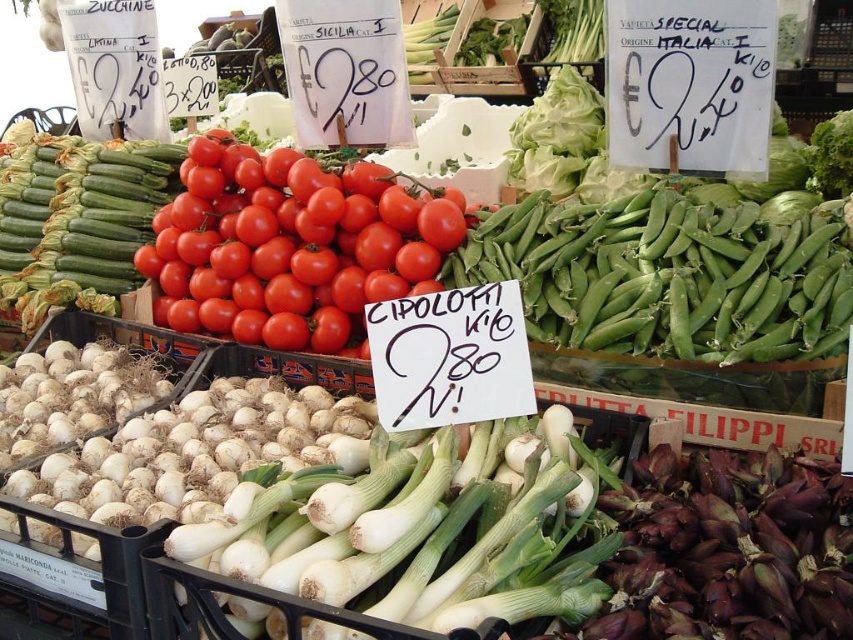
Is green smooth peas at upper right to the right of green matte zucchini at upper left from the viewer's perspective?

Indeed, green smooth peas at upper right is positioned on the right side of green matte zucchini at upper left.

Find the location of a particular element. The width and height of the screenshot is (853, 640). green smooth peas at upper right is located at coordinates (664, 276).

Does shiny red tomatoes at center appear under green matte zucchini at upper left?

Correct, shiny red tomatoes at center is located below green matte zucchini at upper left.

Who is higher up, shiny red tomatoes at center or green matte zucchini at upper left?

green matte zucchini at upper left

Image resolution: width=853 pixels, height=640 pixels. Find the location of `shiny red tomatoes at center`. shiny red tomatoes at center is located at coordinates 291,244.

I want to click on shiny red tomatoes at center, so click(x=291, y=244).

Which of these two, green smooth peas at upper right or shiny red tomatoes at center, stands taller?

shiny red tomatoes at center

Between point (598, 220) and point (271, 273), which one is positioned in front?

Point (598, 220)

Which is in front, point (606, 241) or point (271, 150)?

Point (606, 241) is more forward.

Where is `green smooth peas at upper right`? green smooth peas at upper right is located at coordinates (664, 276).